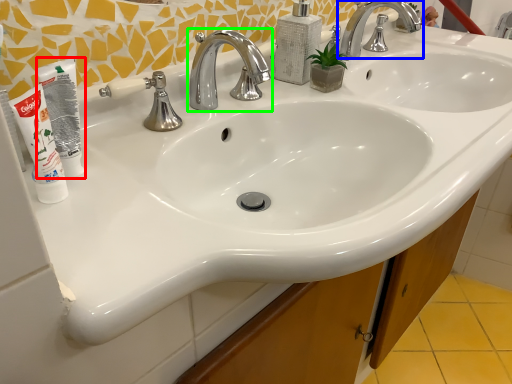
Question: Based on their relative distances, which object is nearer to mouthwash (highlighted by a red box)? Choose from tap (highlighted by a blue box) and tap (highlighted by a green box).

Choices:
 (A) tap
 (B) tap

Answer: (B)